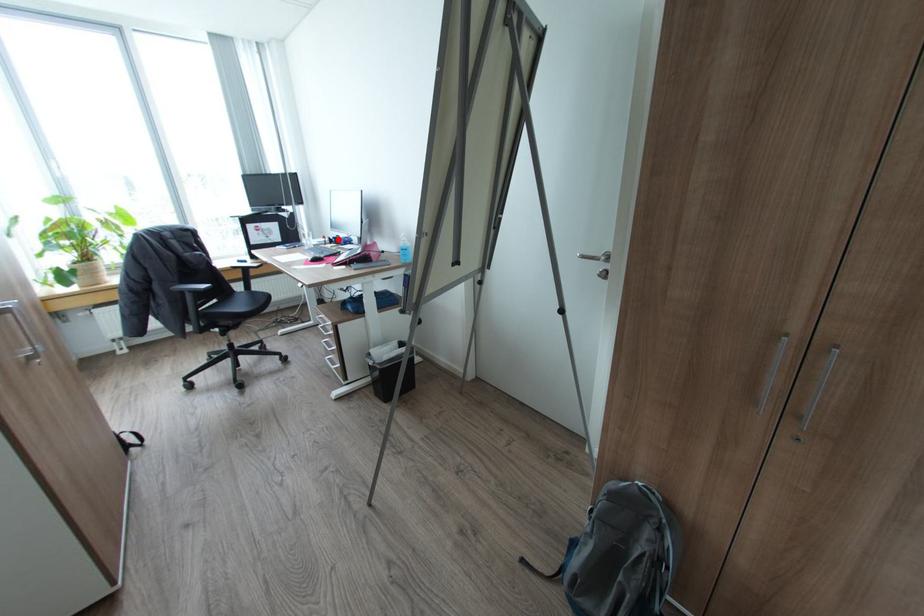
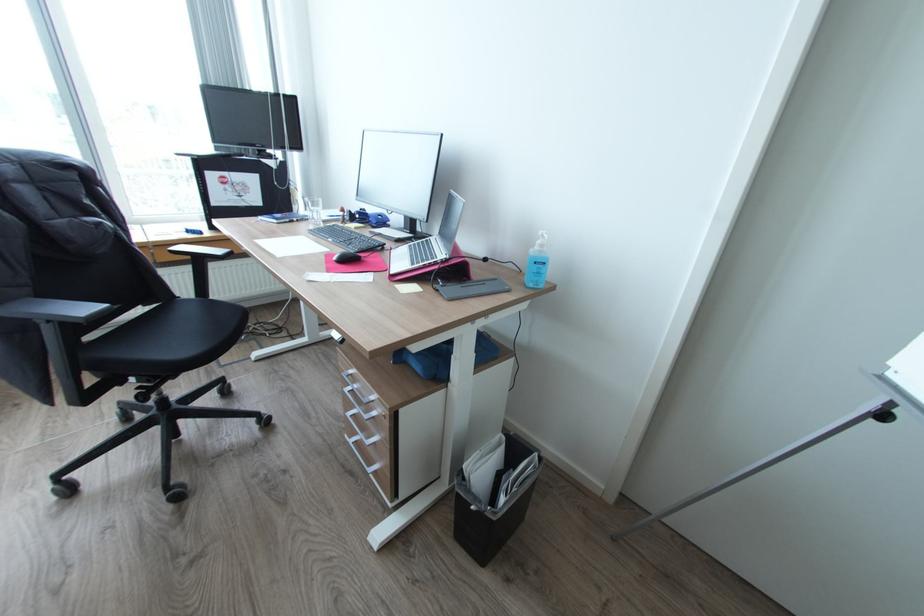
Where in the second image is the point corresponding to the highlighted location from the first image?

(362, 216)